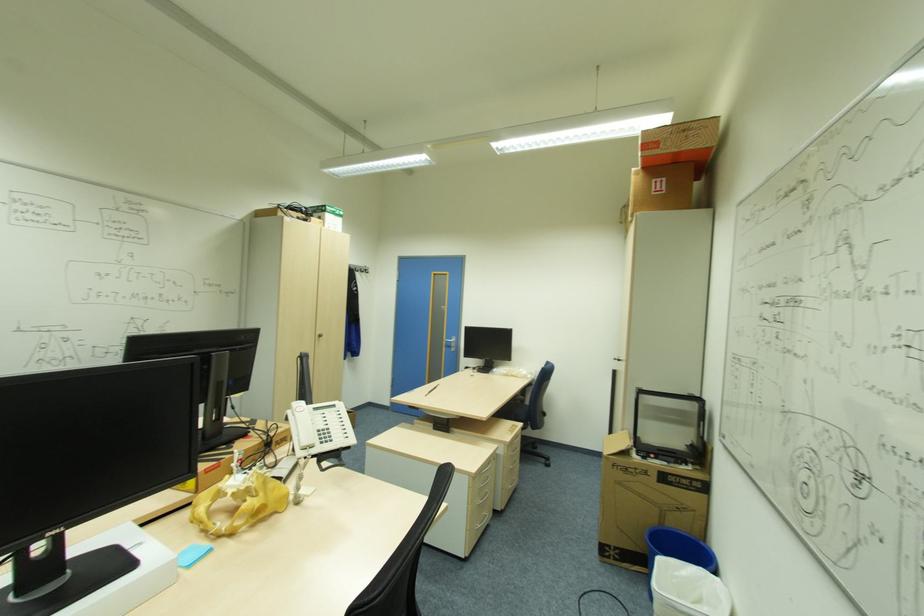
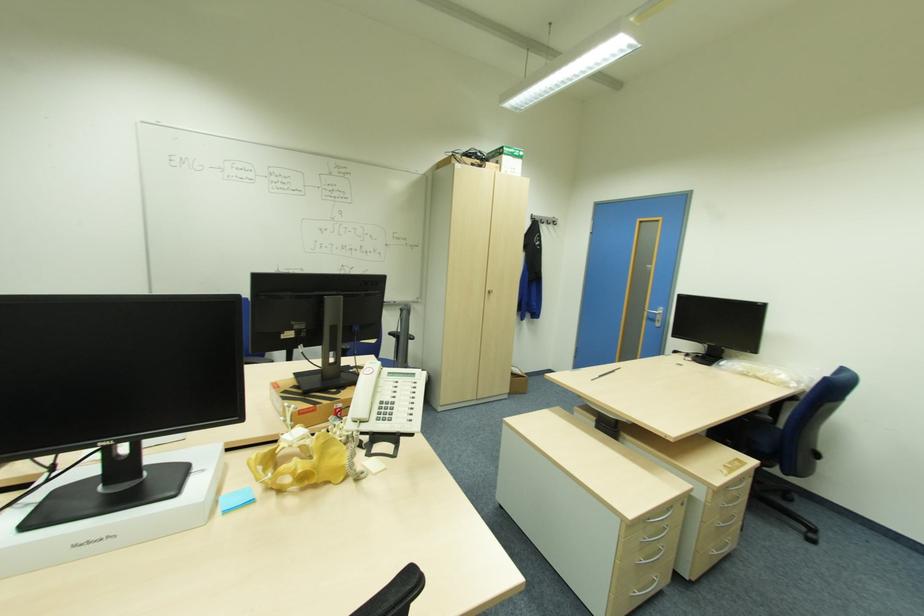
Where in the second image is the point corresponding to point (309, 448) from the first image?

(359, 422)